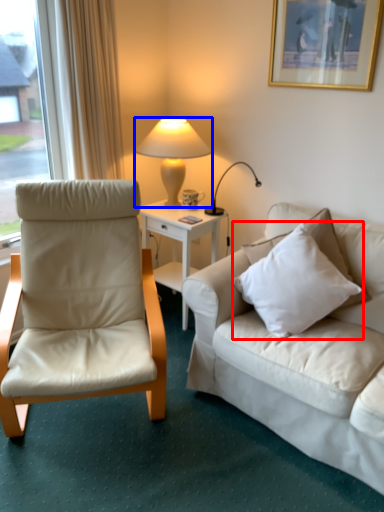
Question: Which point is further to the camera, pillow (highlighted by a red box) or lamp (highlighted by a blue box)?

Choices:
 (A) pillow
 (B) lamp

Answer: (B)